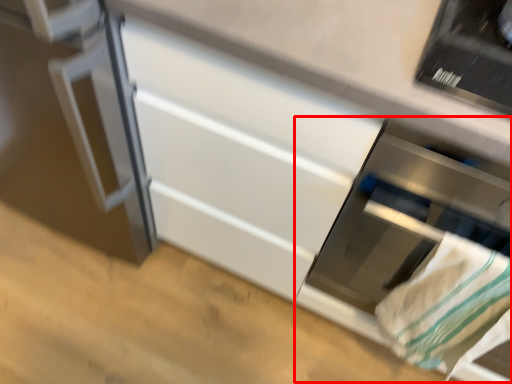
Question: Where is oven (annotated by the red box) located in relation to blanket in the image?

Choices:
 (A) left
 (B) right

Answer: (B)